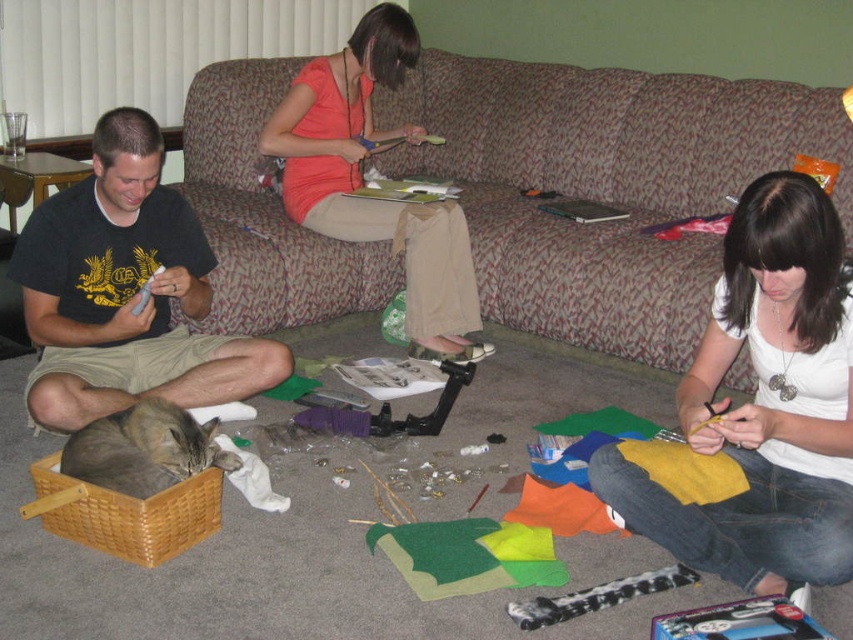
Which is in front, point (457, 134) or point (676, 401)?

Positioned in front is point (676, 401).

Between point (698, 186) and point (688, 397), which one is positioned behind?

Positioned behind is point (698, 186).

Which is behind, point (517, 227) or point (724, 241)?

Point (517, 227)

Find the location of a particular element. The height and width of the screenshot is (640, 853). textured fabric couch at center is located at coordinates (604, 186).

Is black t-shirt at left to the left of orange cotton shirt at center from the viewer's perspective?

Yes, black t-shirt at left is to the left of orange cotton shirt at center.

Does black t-shirt at left appear over orange cotton shirt at center?

No, black t-shirt at left is not above orange cotton shirt at center.

At what (x,y) coordinates should I click in order to perform the action: click on black t-shirt at left. Please return your answer as a coordinate pair (x, y). Looking at the image, I should click on (125, 291).

Can you confirm if white fabric at lower right is thinner than orange cotton shirt at center?

Yes.

Is white fabric at lower right above orange cotton shirt at center?

No.

Is point (709, 561) positioned before point (404, 218)?

Yes, it is in front of point (404, 218).

Locate an element on the screen. This screenshot has height=640, width=853. white fabric at lower right is located at coordinates (764, 403).